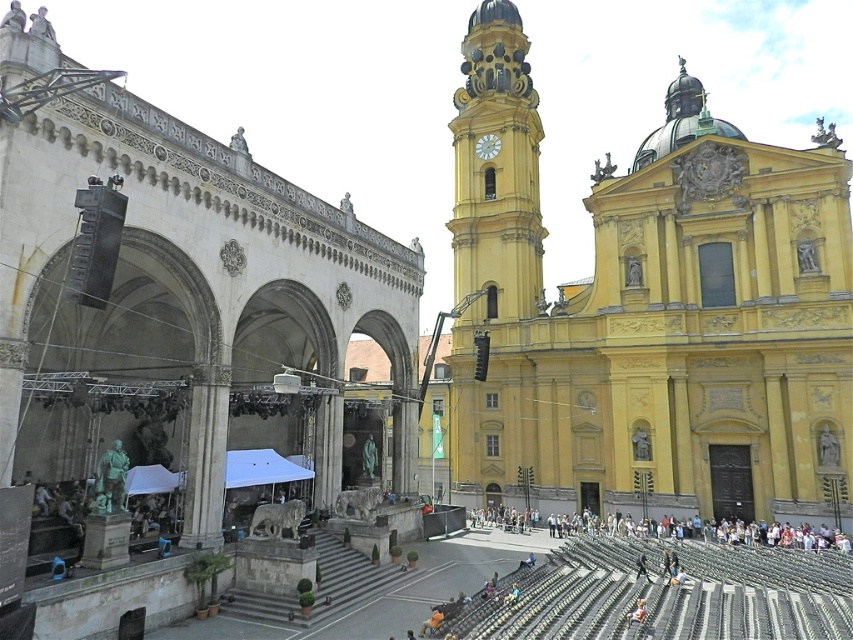
Question: Is yellow stone church at center closer to camera compared to white marble clock at upper center?

Choices:
 (A) no
 (B) yes

Answer: (B)

Question: Which object is closer to the camera taking this photo?

Choices:
 (A) yellow stone church at center
 (B) yellow matte clock tower at upper center
 (C) white fabric crowd at lower center
 (D) white marble clock at upper center

Answer: (C)

Question: Is yellow matte clock tower at upper center below white fabric crowd at lower center?

Choices:
 (A) yes
 (B) no

Answer: (B)

Question: In this image, where is yellow matte clock tower at upper center located relative to white fabric crowd at lower center?

Choices:
 (A) below
 (B) above

Answer: (B)

Question: Which object is farther from the camera taking this photo?

Choices:
 (A) yellow stone church at center
 (B) white fabric crowd at lower center

Answer: (A)

Question: Which object appears farthest from the camera in this image?

Choices:
 (A) white marble clock at upper center
 (B) white fabric crowd at lower center

Answer: (A)